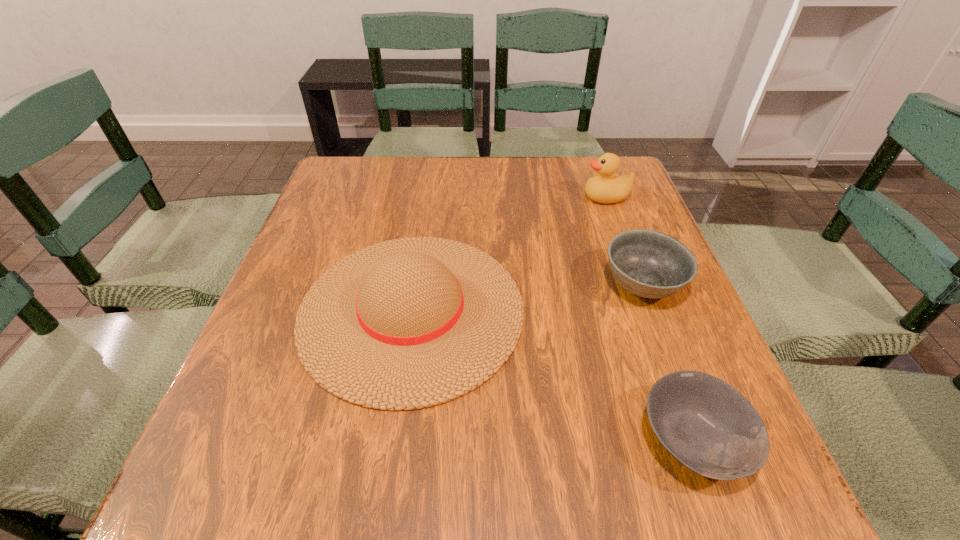
I want to click on vacant space located 0.070m on the back of the farther bowl, so click(x=625, y=238).

Image resolution: width=960 pixels, height=540 pixels. Identify the location of vacant space located 0.330m on the back of the shorter bowl. (629, 261).

Where is `object located at the far edge`? Image resolution: width=960 pixels, height=540 pixels. object located at the far edge is located at coordinates (603, 187).

This screenshot has width=960, height=540. I want to click on object at the near edge, so click(706, 424).

Where is `object that is at the left edge`? The image size is (960, 540). object that is at the left edge is located at coordinates (409, 323).

Image resolution: width=960 pixels, height=540 pixels. Identify the location of duck present at the right edge. (603, 187).

Locate an element on the screen. This screenshot has width=960, height=540. object at the far right corner is located at coordinates (603, 187).

You are a GUI agent. You are given a task and a screenshot of the screen. Output one action in this format:
    pyautogui.click(x=<x>, y=<y>)
    Task: Click on the object present at the near right corner
    This screenshot has height=540, width=960.
    Given the screenshot: What is the action you would take?
    pyautogui.click(x=706, y=424)

Where is `vacant space at the far edge`? The height and width of the screenshot is (540, 960). vacant space at the far edge is located at coordinates (449, 159).

At what (x,y) coordinates should I click in order to perform the action: click on vacant space at the near edge. Please return your answer as a coordinate pair (x, y). Looking at the image, I should click on click(x=397, y=480).